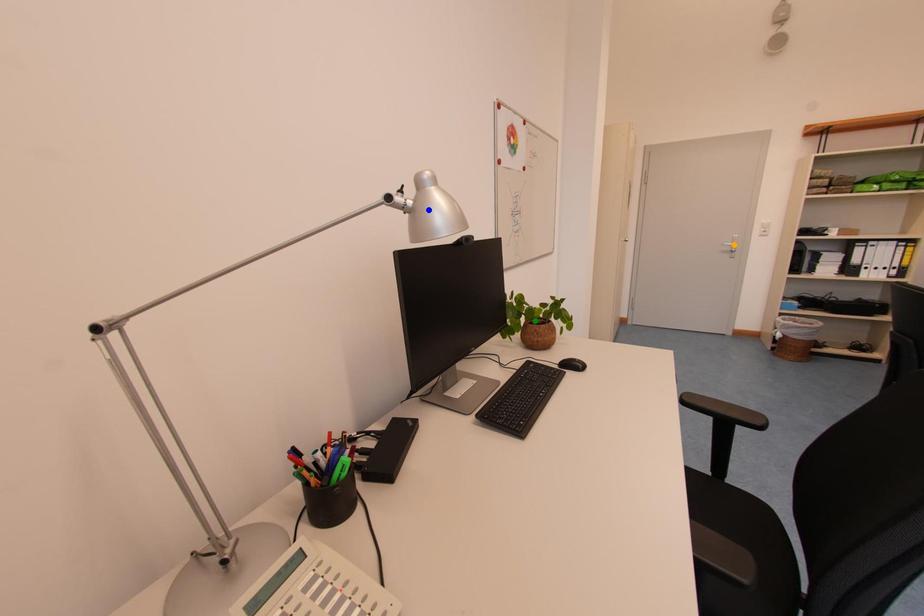
Order these from nearest to farthest:
orange point
blue point
green point

blue point
green point
orange point